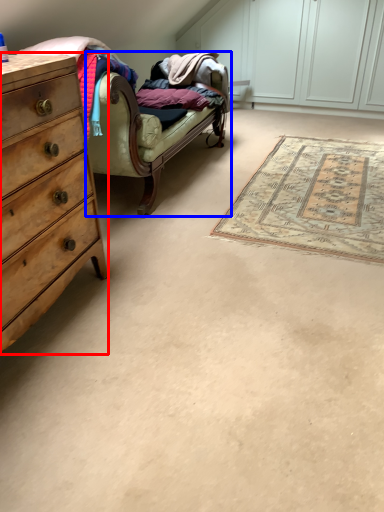
Question: Which point is further to the camera, chest of drawers (highlighted by a red box) or studio couch (highlighted by a blue box)?

Choices:
 (A) chest of drawers
 (B) studio couch

Answer: (B)